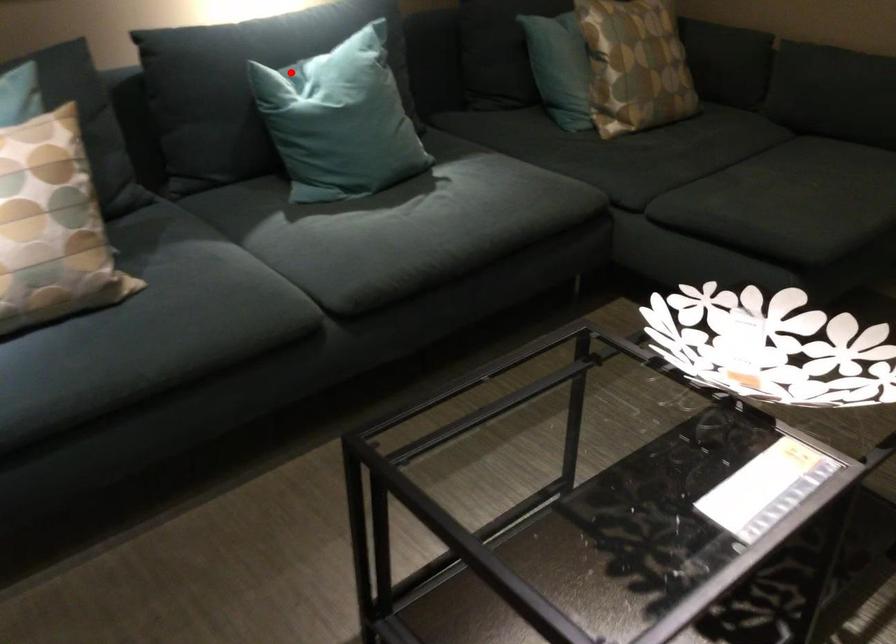
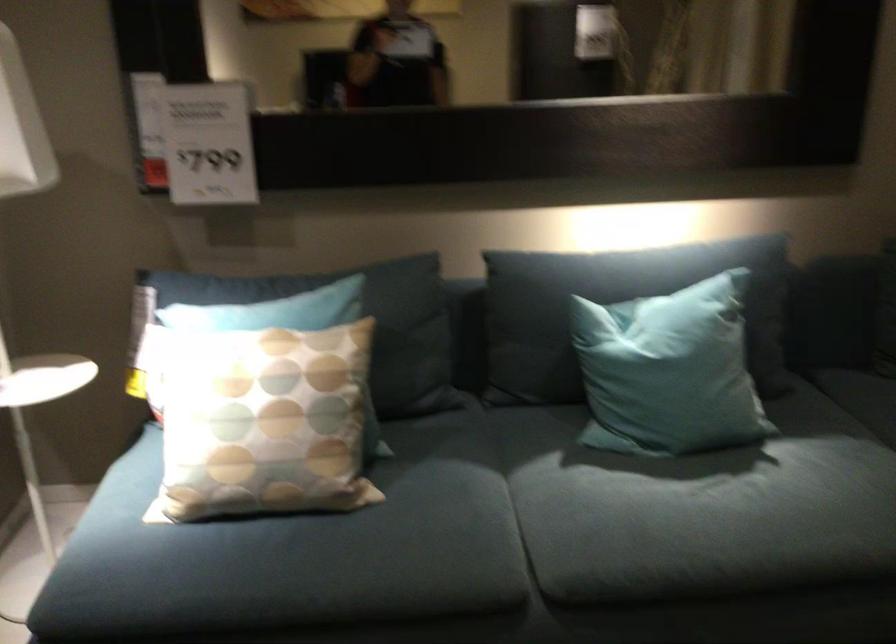
Question: I am providing you with two images of the same scene from different viewpoints. A red point is marked on the first image. Can you still see the location of the red point in image 2?

Choices:
 (A) Yes
 (B) No

Answer: (A)